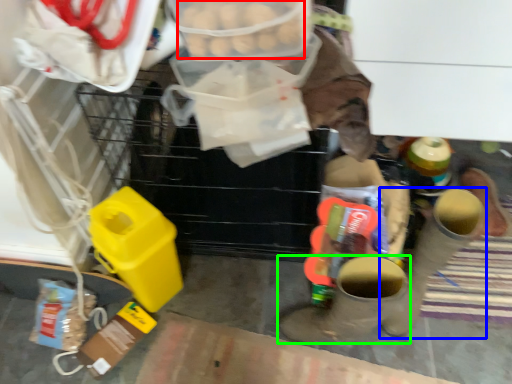
Question: Which object is positioned closest to food (highlighted by a red box)? Select from footwear (highlighted by a blue box) and footwear (highlighted by a green box).

Choices:
 (A) footwear
 (B) footwear

Answer: (B)